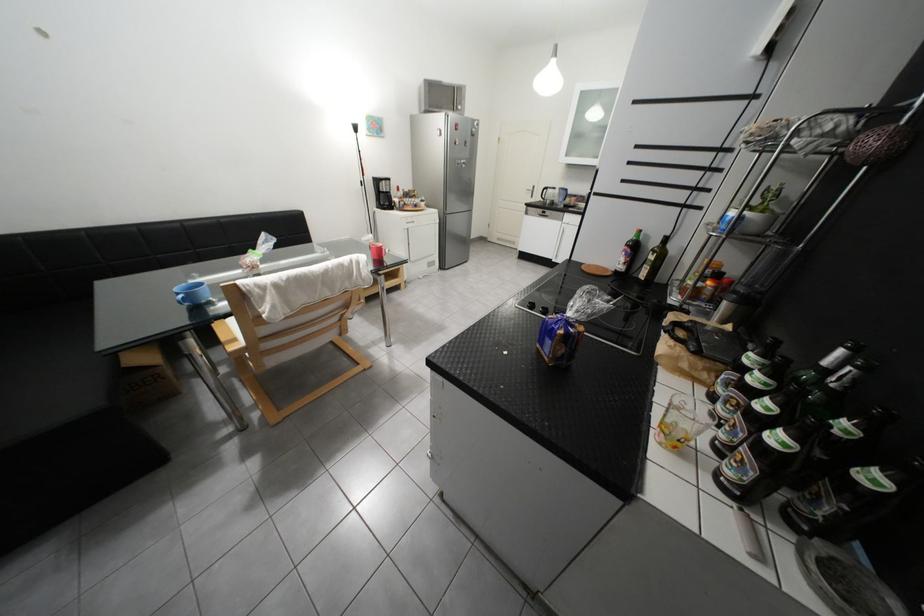
In order to click on silver refrigerator handle in this screenshot , I will do `click(445, 159)`.